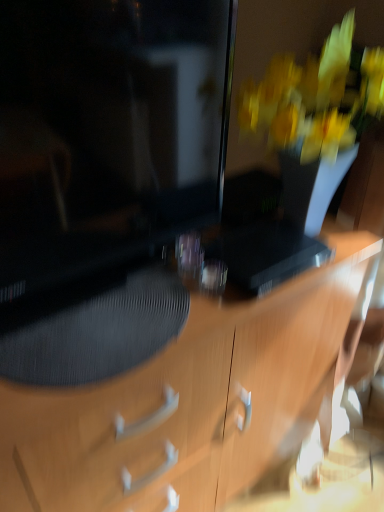
Question: Choose the correct answer: Is wooden desk at center inside matte black monitor at left or outside it?

Choices:
 (A) outside
 (B) inside

Answer: (A)

Question: In terms of height, does wooden desk at center look taller or shorter compared to matte black monitor at left?

Choices:
 (A) tall
 (B) short

Answer: (A)

Question: Which object is positioned closest to the black textured drawer at center?

Choices:
 (A) wooden desk at center
 (B) matte black monitor at left

Answer: (A)

Question: Which is farther from the wooden desk at center?

Choices:
 (A) matte black monitor at left
 (B) black textured drawer at center

Answer: (A)